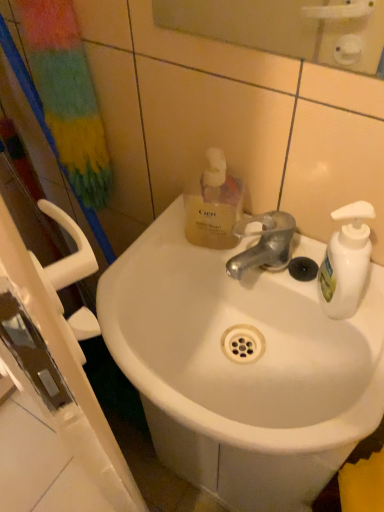
Question: Does glossy plastic mirror at upper center appear on the left side of translucent yellow liquid at upper center?

Choices:
 (A) no
 (B) yes

Answer: (A)

Question: Does glossy plastic mirror at upper center appear on the right side of translucent yellow liquid at upper center?

Choices:
 (A) no
 (B) yes

Answer: (B)

Question: Would you say glossy plastic mirror at upper center contains translucent yellow liquid at upper center?

Choices:
 (A) no
 (B) yes

Answer: (A)

Question: Is glossy plastic mirror at upper center further to camera compared to translucent yellow liquid at upper center?

Choices:
 (A) yes
 (B) no

Answer: (B)

Question: Considering the relative sizes of glossy plastic mirror at upper center and translucent yellow liquid at upper center in the image provided, is glossy plastic mirror at upper center bigger than translucent yellow liquid at upper center?

Choices:
 (A) no
 (B) yes

Answer: (B)

Question: Can you confirm if glossy plastic mirror at upper center is smaller than translucent yellow liquid at upper center?

Choices:
 (A) no
 (B) yes

Answer: (A)

Question: From the image's perspective, is glossy plastic mirror at upper center under white ceramic sink at center?

Choices:
 (A) yes
 (B) no

Answer: (B)

Question: Considering the relative sizes of glossy plastic mirror at upper center and white ceramic sink at center in the image provided, is glossy plastic mirror at upper center shorter than white ceramic sink at center?

Choices:
 (A) no
 (B) yes

Answer: (A)

Question: Is glossy plastic mirror at upper center with white ceramic sink at center?

Choices:
 (A) no
 (B) yes

Answer: (A)

Question: From a real-world perspective, is glossy plastic mirror at upper center on top of white ceramic sink at center?

Choices:
 (A) no
 (B) yes

Answer: (B)

Question: Could white ceramic sink at center be considered to be inside glossy plastic mirror at upper center?

Choices:
 (A) no
 (B) yes

Answer: (A)

Question: Is glossy plastic mirror at upper center positioned beyond the bounds of white ceramic sink at center?

Choices:
 (A) no
 (B) yes

Answer: (B)

Question: From the image's perspective, is translucent yellow liquid at upper center located above glossy plastic mirror at upper center?

Choices:
 (A) no
 (B) yes

Answer: (A)